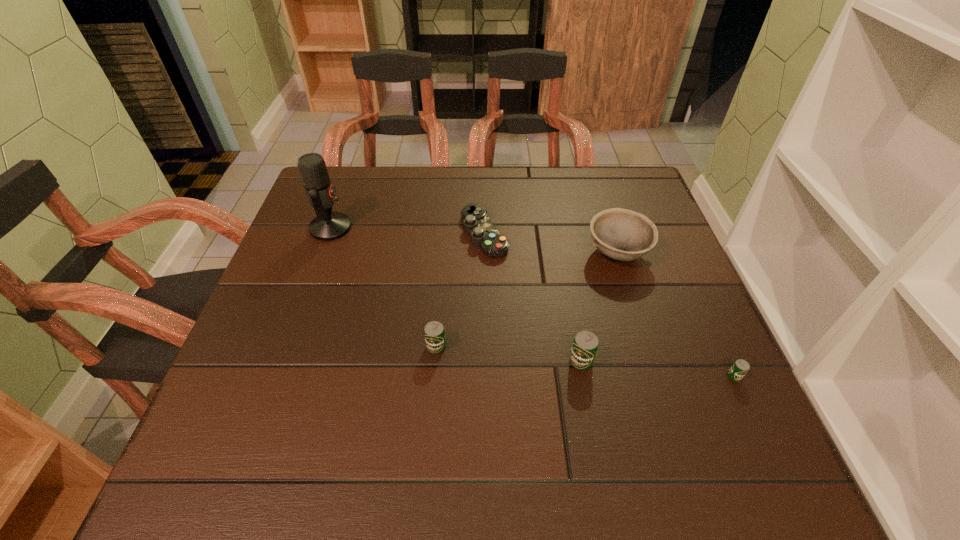
Locate an element on the screen. The image size is (960, 540). vacant space that satisfies the following two spatial constraints: 1. on the side of the tallest object with the red ring; 2. on the left side of the bowl is located at coordinates (322, 253).

Where is `vacant point that satisfies the following two spatial constraints: 1. on the side of the microphone with the red ring; 2. on the left side of the bowl`? Image resolution: width=960 pixels, height=540 pixels. vacant point that satisfies the following two spatial constraints: 1. on the side of the microphone with the red ring; 2. on the left side of the bowl is located at coordinates (322, 253).

Identify the location of vacant space that satisfies the following two spatial constraints: 1. on the back side of the bowl; 2. on the side of the microphone with the red ring. (610, 227).

Where is `free space that satisfies the following two spatial constraints: 1. on the back side of the leftmost beer can; 2. on the side of the tallest object with the red ring`? This screenshot has width=960, height=540. free space that satisfies the following two spatial constraints: 1. on the back side of the leftmost beer can; 2. on the side of the tallest object with the red ring is located at coordinates (446, 227).

The height and width of the screenshot is (540, 960). In order to click on free spot that satisfies the following two spatial constraints: 1. on the side of the tallest object with the red ring; 2. on the back side of the second shortest beer can in this screenshot , I will do `click(287, 347)`.

What are the coordinates of `free space in the image that satisfies the following two spatial constraints: 1. on the side of the tallest object with the red ring; 2. on the right side of the control` in the screenshot? It's located at (328, 234).

The image size is (960, 540). In order to click on vacant point that satisfies the following two spatial constraints: 1. on the back side of the leftmost beer can; 2. on the left side of the bowl in this screenshot , I will do `click(444, 253)`.

Image resolution: width=960 pixels, height=540 pixels. I want to click on vacant position in the image that satisfies the following two spatial constraints: 1. on the front side of the control; 2. on the right side of the second beer can from left to right, so click(x=485, y=361).